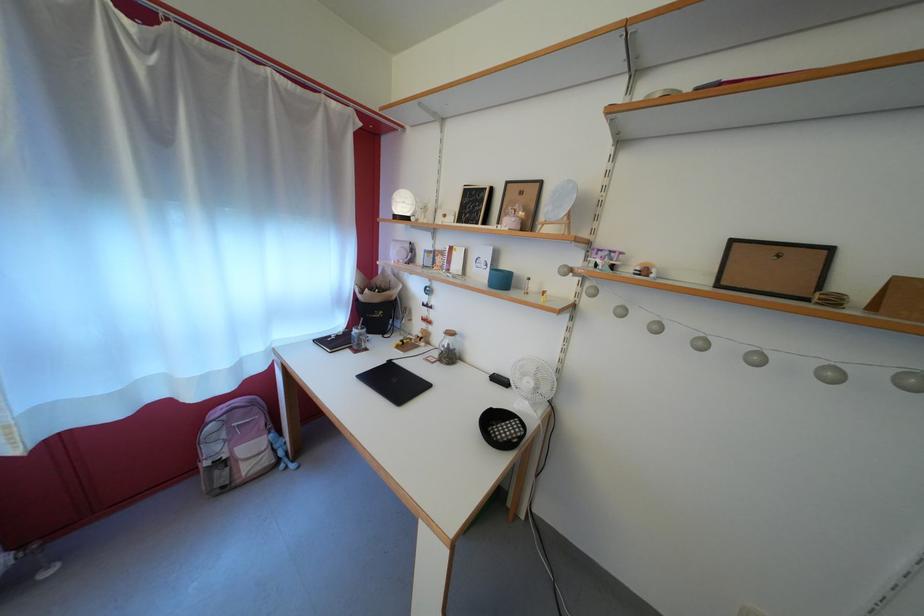
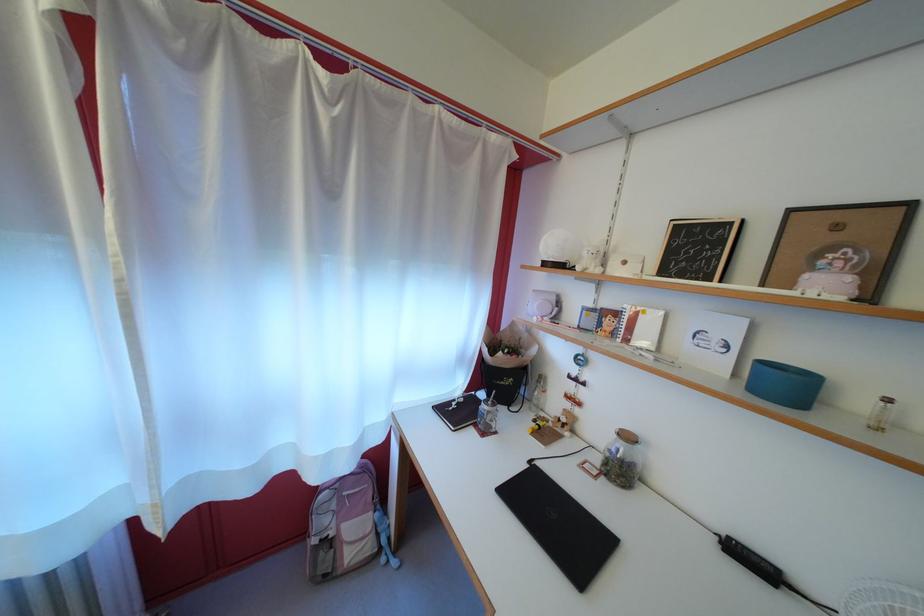
Question: The camera is either moving clockwise (left) or counter-clockwise (right) around the object. The first image is from the beginning of the video and the second image is from the end. Is the camera moving left or right when shooting the video?

Choices:
 (A) Left
 (B) Right

Answer: (B)